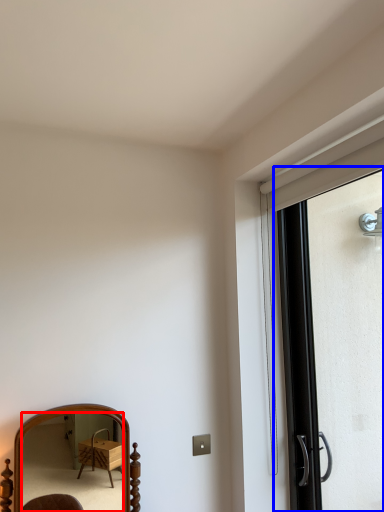
Question: Which point is closer to the camera, mirror (highlighted by a red box) or screen door (highlighted by a blue box)?

Choices:
 (A) mirror
 (B) screen door

Answer: (B)